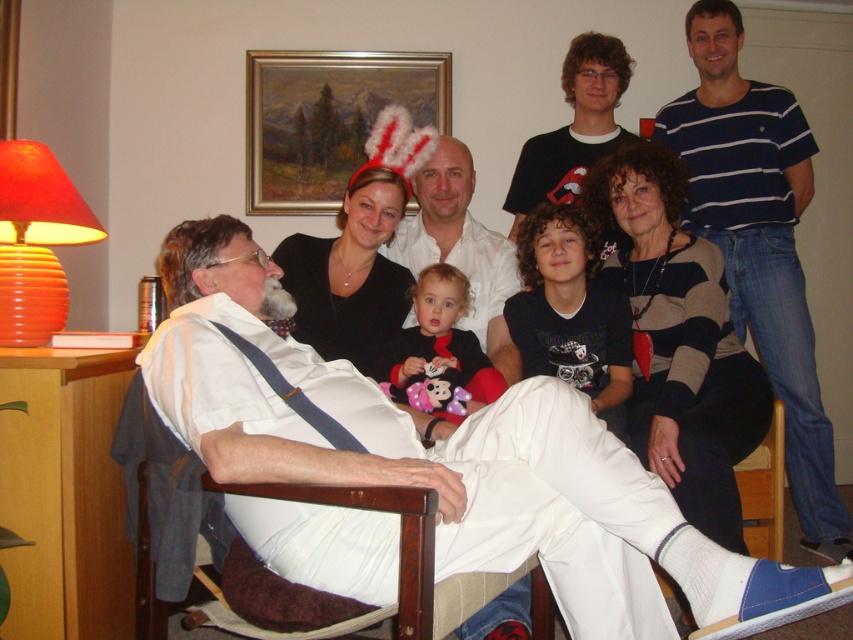
Question: Can you confirm if oil painting at upper center is smaller than black matte shirt at center?

Choices:
 (A) yes
 (B) no

Answer: (A)

Question: Considering the real-world distances, which object is closest to the oil painting at upper center?

Choices:
 (A) wooden armchair at lower left
 (B) black matte shirt at center
 (C) soft plush toy at center
 (D) blue striped shirt at upper right

Answer: (D)

Question: Is oil painting at upper center bigger than soft plush toy at center?

Choices:
 (A) no
 (B) yes

Answer: (B)

Question: Among these objects, which one is farthest from the camera?

Choices:
 (A) oil painting at upper center
 (B) soft plush toy at center

Answer: (A)

Question: From the image, what is the correct spatial relationship of blue striped shirt at upper right in relation to soft plush toy at center?

Choices:
 (A) below
 (B) above

Answer: (B)

Question: Which object is the farthest from the blue striped shirt at upper right?

Choices:
 (A) wooden armchair at lower left
 (B) soft plush toy at center

Answer: (A)